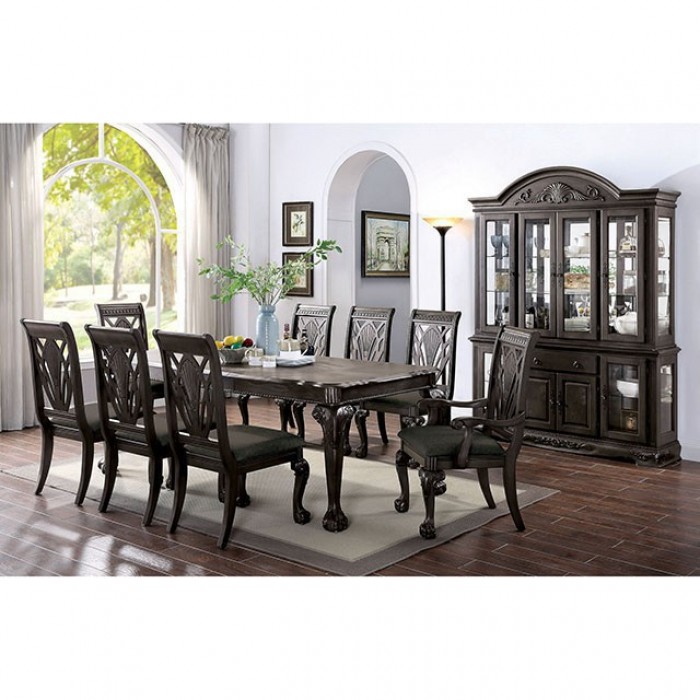
Where is `chair backs`? This screenshot has height=700, width=700. chair backs is located at coordinates (136, 308), (119, 330), (63, 326), (183, 336), (508, 329), (452, 315), (370, 304), (312, 308).